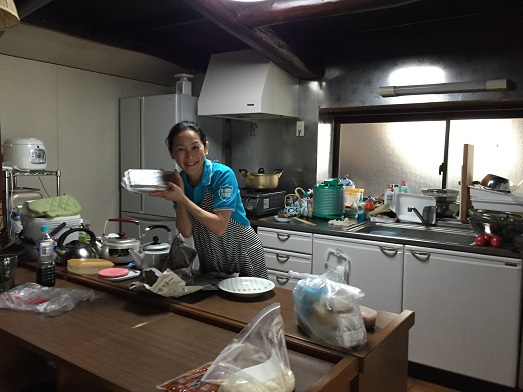
Where is `bottle`? bottle is located at coordinates (51, 250).